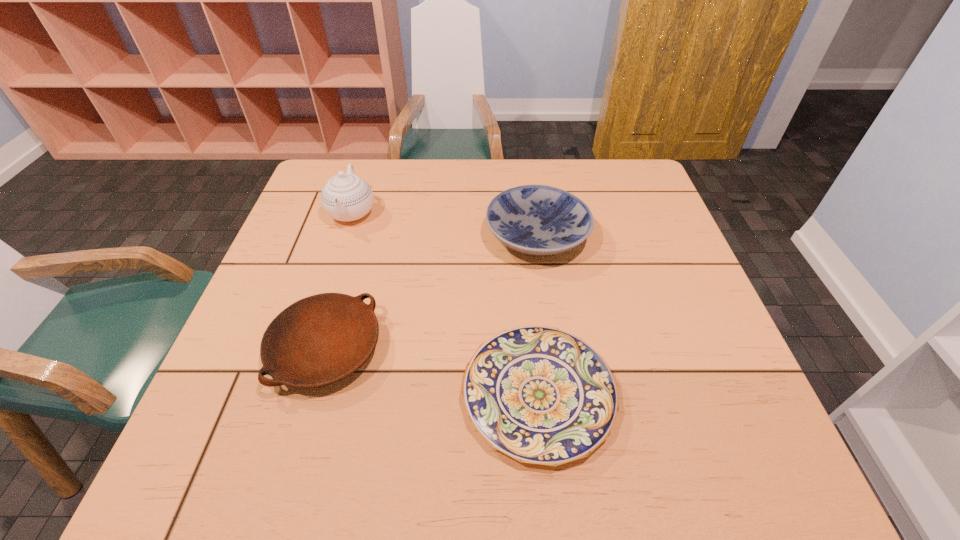
Locate an element on the screen. blank region between the tallest plate and the leftmost plate is located at coordinates (432, 293).

Locate an element on the screen. The image size is (960, 540). vacant area that lies between the shortest plate and the second shortest object is located at coordinates (432, 372).

At what (x,y) coordinates should I click in order to perform the action: click on vacant area between the third shortest object and the shortest plate. Please return your answer as a coordinate pair (x, y). Image resolution: width=960 pixels, height=540 pixels. Looking at the image, I should click on (538, 315).

This screenshot has height=540, width=960. Identify the location of unoccupied position between the tallest plate and the third tallest object. (432, 293).

Where is `vacant area between the leftmost plate and the farthest plate`? Image resolution: width=960 pixels, height=540 pixels. vacant area between the leftmost plate and the farthest plate is located at coordinates (432, 293).

At what (x,y) coordinates should I click in order to perform the action: click on free area in between the chinaware and the farthest plate. Please return your answer as a coordinate pair (x, y). The height and width of the screenshot is (540, 960). Looking at the image, I should click on (444, 224).

The height and width of the screenshot is (540, 960). Identify the location of blank region between the tallest plate and the second tallest plate. (432, 293).

Image resolution: width=960 pixels, height=540 pixels. Find the location of `free area in between the tallest plate and the third tallest object`. free area in between the tallest plate and the third tallest object is located at coordinates (432, 293).

You are a GUI agent. You are given a task and a screenshot of the screen. Output one action in this format:
    pyautogui.click(x=<x>, y=<y>)
    Task: Click on the free spot between the tallest plate and the shortest object
    Image resolution: width=960 pixels, height=540 pixels.
    Given the screenshot: What is the action you would take?
    pyautogui.click(x=538, y=315)

I want to click on vacant area that lies between the shortest object and the chinaware, so click(445, 304).